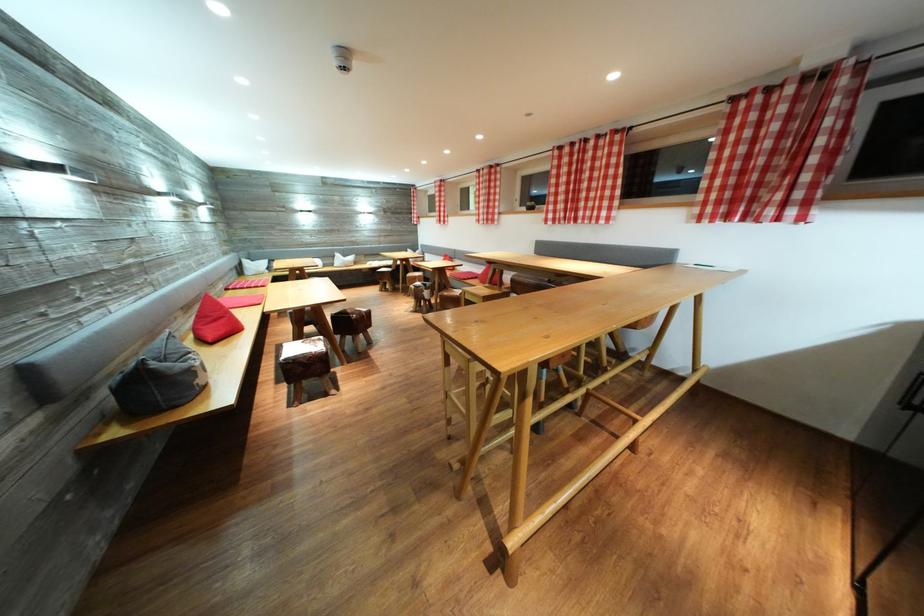
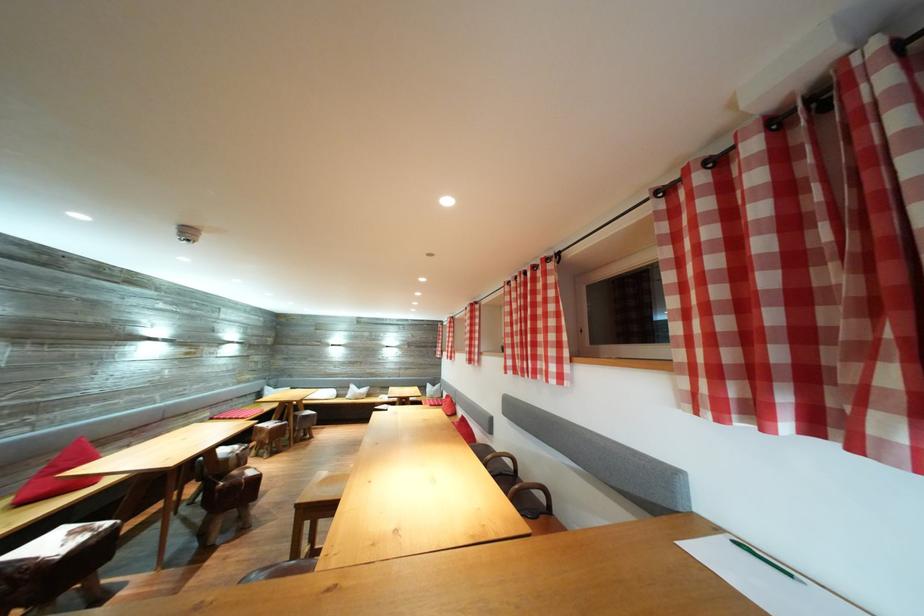
In the second image, find the point that corresponds to pixel 776 95 in the first image.

(725, 166)